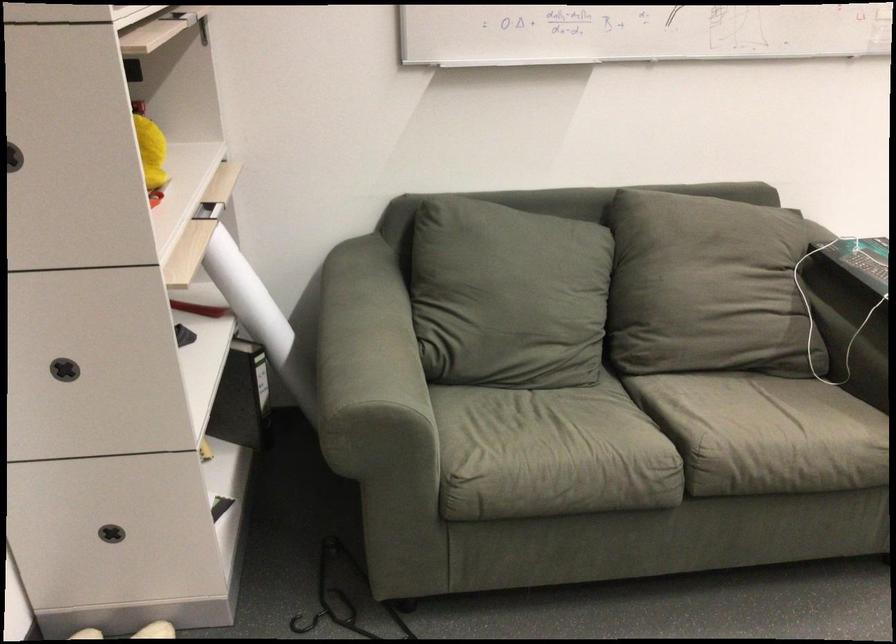
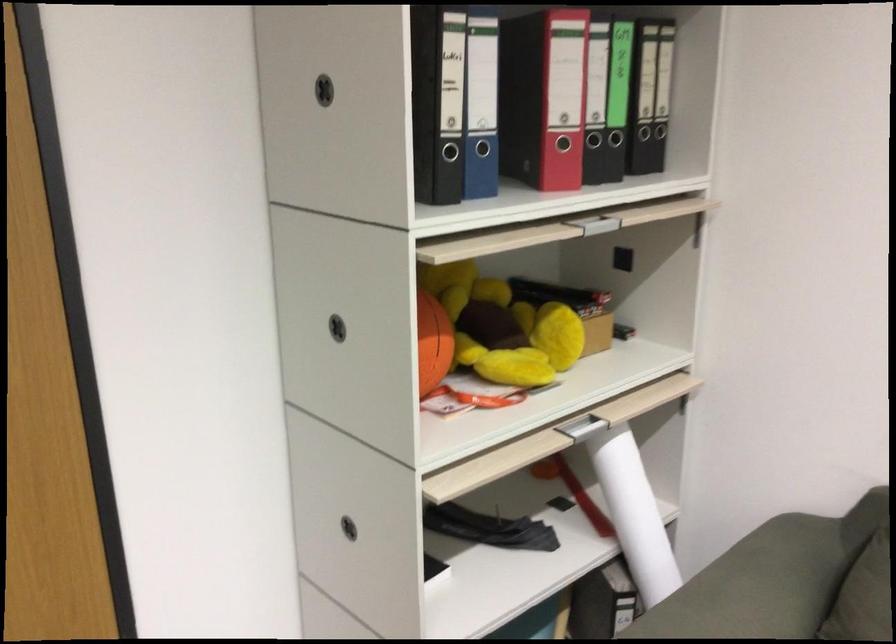
Locate, in the second image, the point that corresponds to point (78, 158) in the first image.

(433, 343)